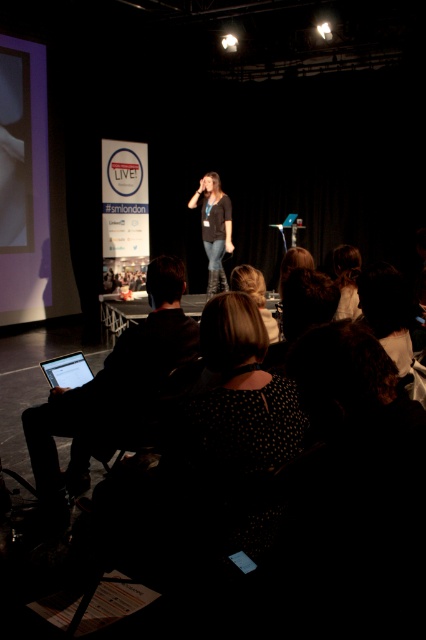
Question: Considering the relative positions of white matte shirt at upper center and blonde hair at center in the image provided, where is white matte shirt at upper center located with respect to blonde hair at center?

Choices:
 (A) right
 (B) left

Answer: (A)

Question: Among these objects, which one is farthest from the camera?

Choices:
 (A) dark brown leather jacket at center
 (B) matte black laptop at lower left
 (C) white matte shirt at upper center
 (D) blonde hair at center

Answer: (A)

Question: Based on their relative distances, which object is farther from the matte black laptop at lower left?

Choices:
 (A) dark brown leather jacket at center
 (B) white matte shirt at upper center

Answer: (A)

Question: Can you confirm if matte black laptop at lower left is wider than dark brown leather jacket at center?

Choices:
 (A) yes
 (B) no

Answer: (A)

Question: Which point appears closest to the camera in this image?

Choices:
 (A) (210, 250)
 (B) (345, 305)

Answer: (B)

Question: From the image, what is the correct spatial relationship of matte black laptop at lower left in relation to blonde hair at center?

Choices:
 (A) right
 (B) left

Answer: (B)